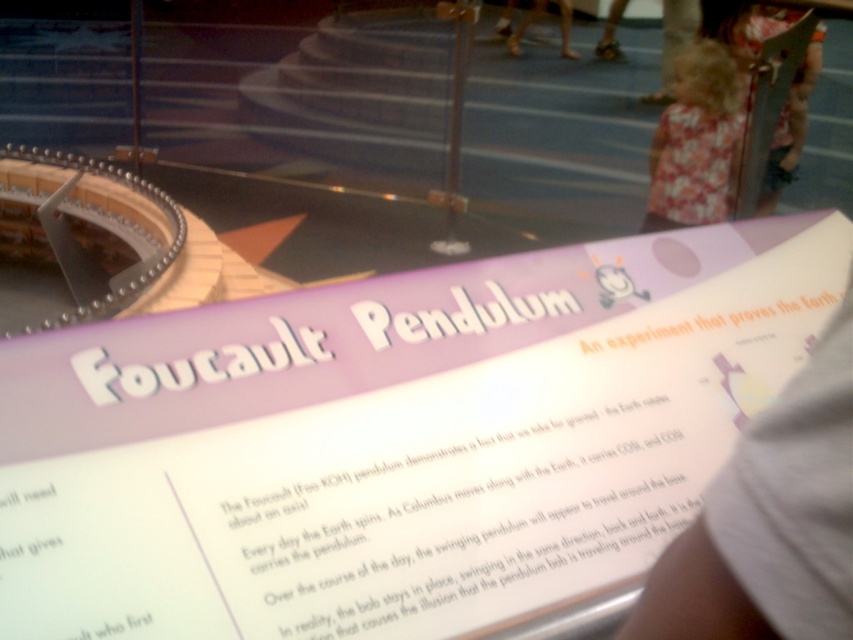
Is white fabric at lower right positioned in front of floral dress at right?

Yes, it is in front of floral dress at right.

Is point (706, 532) closer to viewer compared to point (722, 48)?

Yes, point (706, 532) is closer to viewer.

Where is `white fabric at lower right`? white fabric at lower right is located at coordinates (770, 520).

Does floral dress at right appear under fluffy pink dress at upper right?

Indeed, floral dress at right is positioned under fluffy pink dress at upper right.

Is floral dress at right thinner than fluffy pink dress at upper right?

Yes.

What do you see at coordinates (695, 140) in the screenshot?
I see `floral dress at right` at bounding box center [695, 140].

The width and height of the screenshot is (853, 640). Find the location of `floral dress at right`. floral dress at right is located at coordinates (695, 140).

How much distance is there between white fabric at lower right and fluffy pink dress at upper right?

white fabric at lower right is 3.28 meters from fluffy pink dress at upper right.

Between white fabric at lower right and fluffy pink dress at upper right, which one has less height?

white fabric at lower right

Between point (809, 513) and point (779, 129), which one is positioned in front?

Point (809, 513) is in front.

The height and width of the screenshot is (640, 853). Find the location of `white fabric at lower right`. white fabric at lower right is located at coordinates (770, 520).